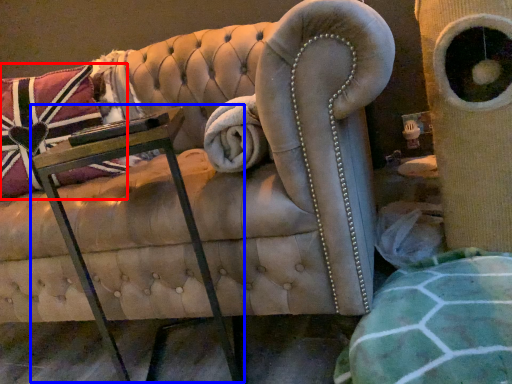
Question: Which point is closer to the camera, throw pillow (highlighted by a red box) or table (highlighted by a blue box)?

Choices:
 (A) throw pillow
 (B) table

Answer: (B)